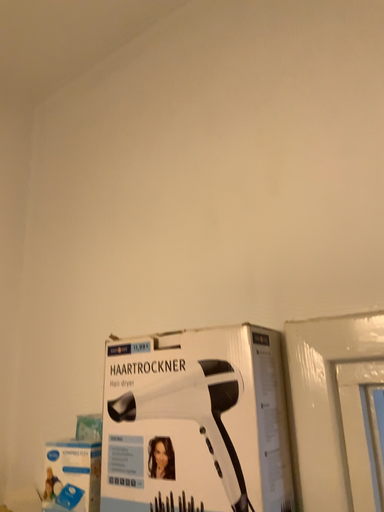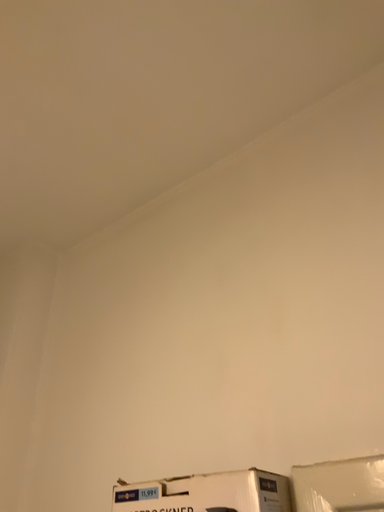
Question: Which way did the camera rotate in the video?

Choices:
 (A) rotated downward
 (B) rotated upward

Answer: (B)